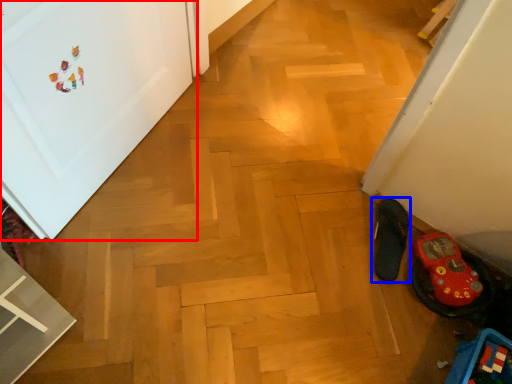
Question: Among these objects, which one is farthest to the camera, door (highlighted by a red box) or footwear (highlighted by a blue box)?

Choices:
 (A) door
 (B) footwear

Answer: (B)